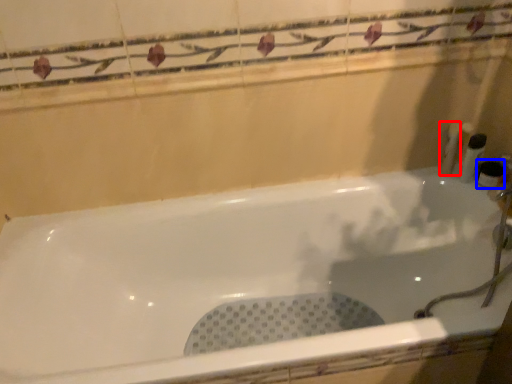
Question: Which object appears closest to the camera in this image, toiletry (highlighted by a red box) or toiletry (highlighted by a blue box)?

Choices:
 (A) toiletry
 (B) toiletry

Answer: (B)